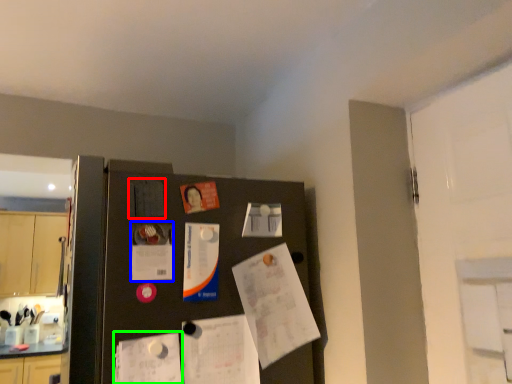
Question: Which object is positioned farthest from poster (highlighted by a red box)? Select from poster (highlighted by a blue box) and poster (highlighted by a green box).

Choices:
 (A) poster
 (B) poster

Answer: (B)